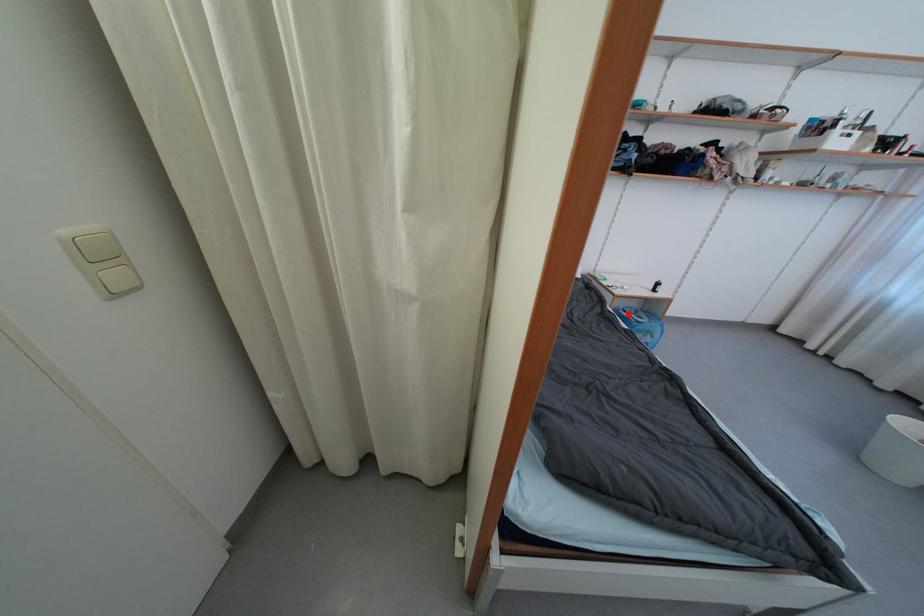
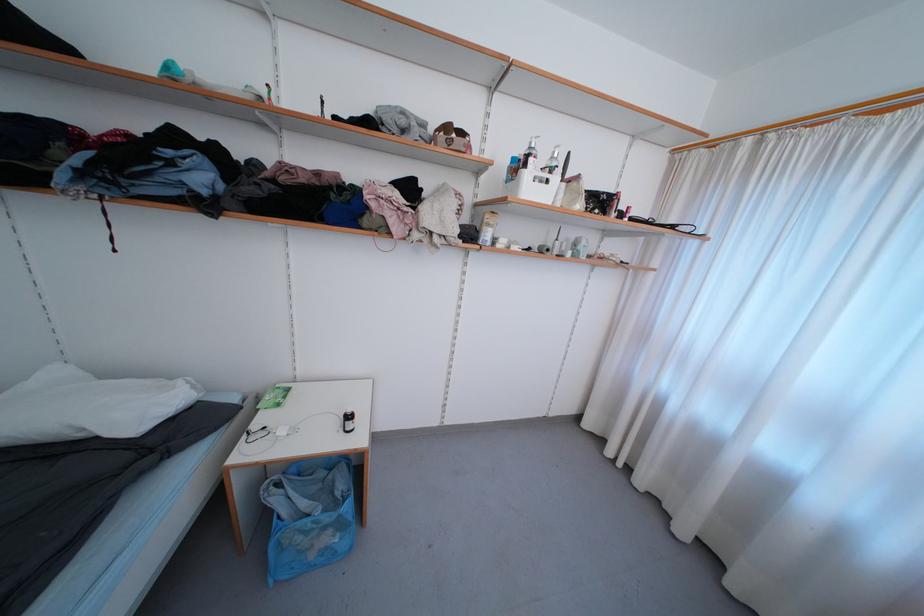
Question: I am providing you with two images of the same scene from different viewpoints. A red point is shown in image1. For the corresponding object point in image2, is it positioned nearer or farther from the camera?

Choices:
 (A) Nearer
 (B) Farther

Answer: (A)